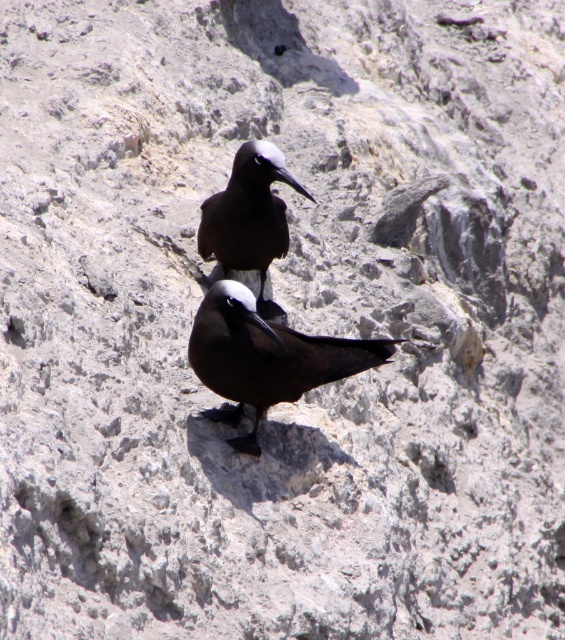
Question: Does matte black bird at center appear on the right side of brown glossy bird at center?

Choices:
 (A) no
 (B) yes

Answer: (B)

Question: Which object appears closest to the camera in this image?

Choices:
 (A) brown glossy bird at center
 (B) matte black bird at center

Answer: (B)

Question: Is matte black bird at center closer to the viewer compared to brown glossy bird at center?

Choices:
 (A) no
 (B) yes

Answer: (B)

Question: Is matte black bird at center to the right of brown glossy bird at center from the viewer's perspective?

Choices:
 (A) yes
 (B) no

Answer: (A)